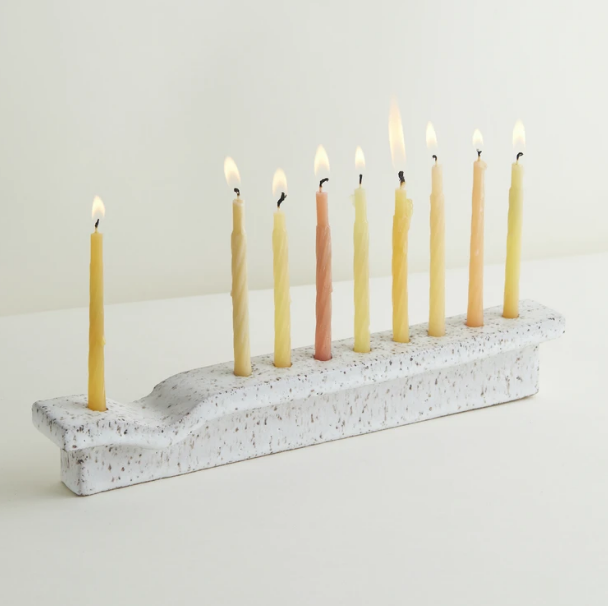
The height and width of the screenshot is (606, 608). What are the coordinates of `surface` in the screenshot? It's located at (511, 437).